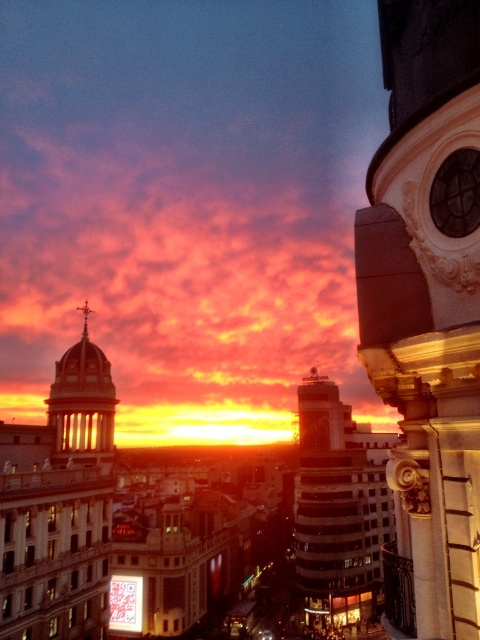
Between gold ornate tower at upper right and matte gold dome at center-left, which one is positioned lower?

matte gold dome at center-left

Measure the distance between gold ornate tower at upper right and camera.

They are 17.82 meters apart.

Between point (466, 438) and point (74, 412), which one is positioned in front?

Positioned in front is point (466, 438).

Where is `gold ornate tower at upper right`? gold ornate tower at upper right is located at coordinates (429, 296).

Is gold ornate tower at upper right to the left of matte gold dome at left from the viewer's perspective?

Incorrect, gold ornate tower at upper right is not on the left side of matte gold dome at left.

Can you confirm if gold ornate tower at upper right is shorter than matte gold dome at left?

Correct, gold ornate tower at upper right is not as tall as matte gold dome at left.

What do you see at coordinates (429, 296) in the screenshot? Image resolution: width=480 pixels, height=640 pixels. I see `gold ornate tower at upper right` at bounding box center [429, 296].

Where is `gold ornate tower at upper right`? The width and height of the screenshot is (480, 640). gold ornate tower at upper right is located at coordinates (429, 296).

Is matte gold dome at left positioned before matte gold dome at center-left?

Yes, it is.

Does point (2, 618) come farther from viewer compared to point (104, 456)?

No.

Where is `matte gold dome at left`? matte gold dome at left is located at coordinates click(x=60, y=506).